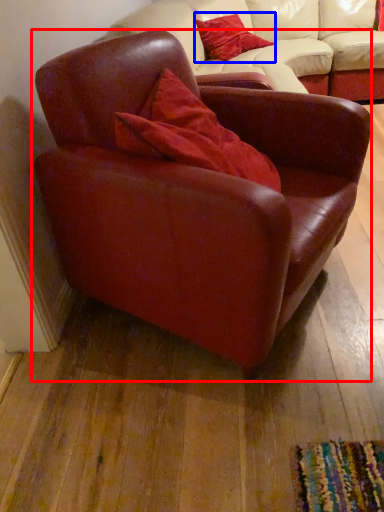
Question: Among these objects, which one is farthest to the camera, chair (highlighted by a red box) or pillow (highlighted by a blue box)?

Choices:
 (A) chair
 (B) pillow

Answer: (B)